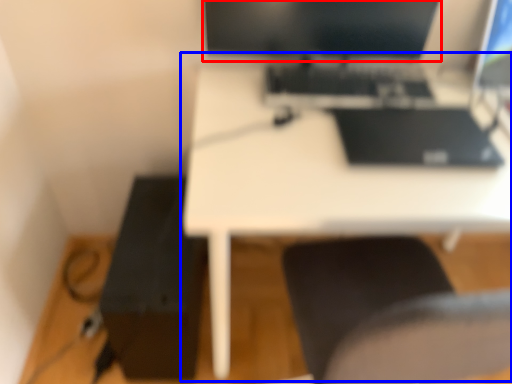
Question: Which of the following is the farthest to the observer, computer monitor (highlighted by a red box) or table (highlighted by a blue box)?

Choices:
 (A) computer monitor
 (B) table

Answer: (A)